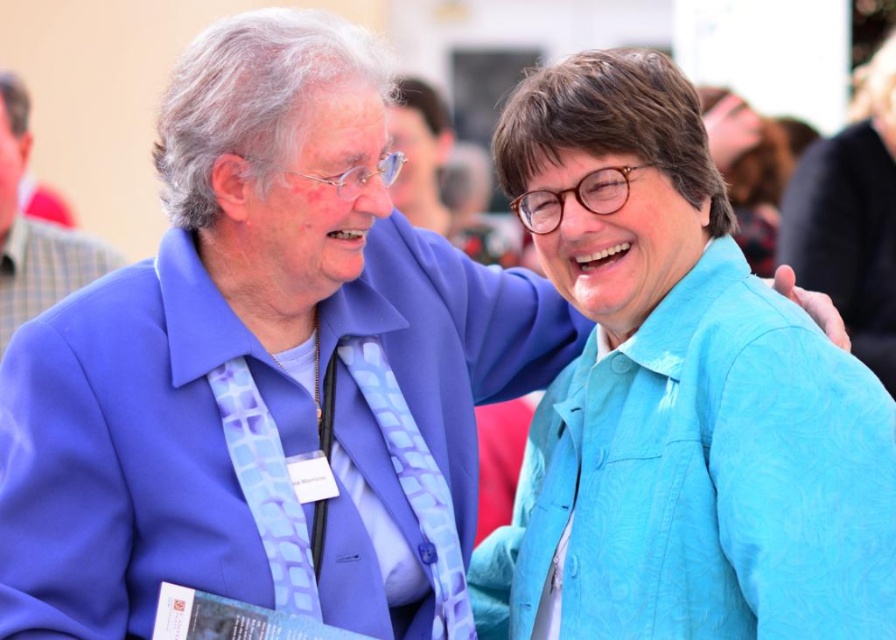
You are organizing a photoshoot and need to arrange the two people in the image so that the matte blue suit at left is to the right of the blue textured jacket at upper right. Is this possible based on their current positions?

The matte blue suit at left is currently positioned on the left side of the blue textured jacket at upper right, so to place the matte blue suit at left to the right of the blue textured jacket at upper right would require them to swap positions.

You are standing in front of the image and want to locate the blue fabric shirt at right. According to the coordinates provided, where exactly is it positioned?

The blue fabric shirt at right is positioned at point 0.345 on the x axis and 0.951 on the y axis.

You are organizing a photo shoot and need to arrange two blue outfits side by side. The blue fabric shirt at right and the matte blue suit at left are available. Based on the scene, which outfit should you choose if you want the one that appears wider?

The blue fabric shirt at right should be chosen because it might be wider than the matte blue suit at left according to the description.